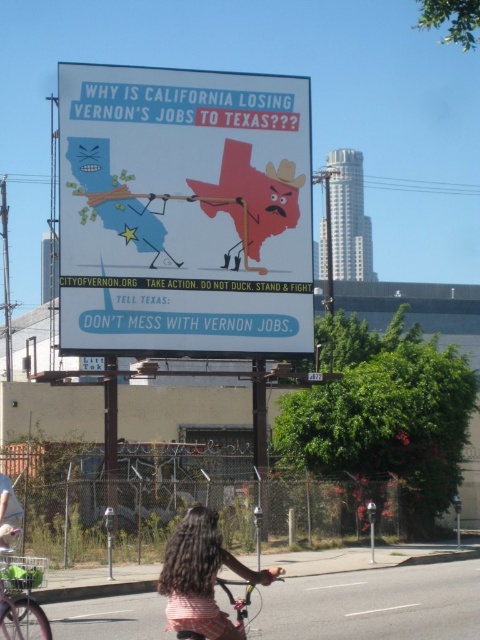
You are a photographer standing in front of the billboard. You want to capture a photo of the metallic silver bicycle at lower center and the long curly hair at lower center. Which object should you focus on first if you want to include both in your frame without moving the camera?

The long curly hair at lower center is positioned on the left side of the metallic silver bicycle at lower center. Since they are both at lower center, focusing on the metallic silver bicycle at lower center first would allow you to frame both objects as they are adjacent to each other.

You are a pedestrian standing at the bottom of the image. You want to ride your green matte bicycle at lower left to the nearby park but need to pass by the white plastic parking meter at lower right. Can you safely ride past the parking meter without hitting it?

The green matte bicycle at lower left is in front of the white plastic parking meter at lower right, meaning the bicycle is already positioned closer to you than the parking meter. Since you are at the bottom of the image, you can safely ride past the parking meter as the bicycle is already ahead of it.

You are a photographer standing in front of the billboard. You want to take a picture of the billboard while including both the green matte bicycle at lower left and the white plastic parking meter at lower right in the frame. Based on their positions, where should you position yourself relative to the objects to ensure both are visible?

To include both the green matte bicycle at lower left and the white plastic parking meter at lower right in the frame, you should position yourself in front of the billboard, between the two objects. Since the green matte bicycle at lower left is above the white plastic parking meter at lower right, standing centrally will allow both to be captured in the photo.